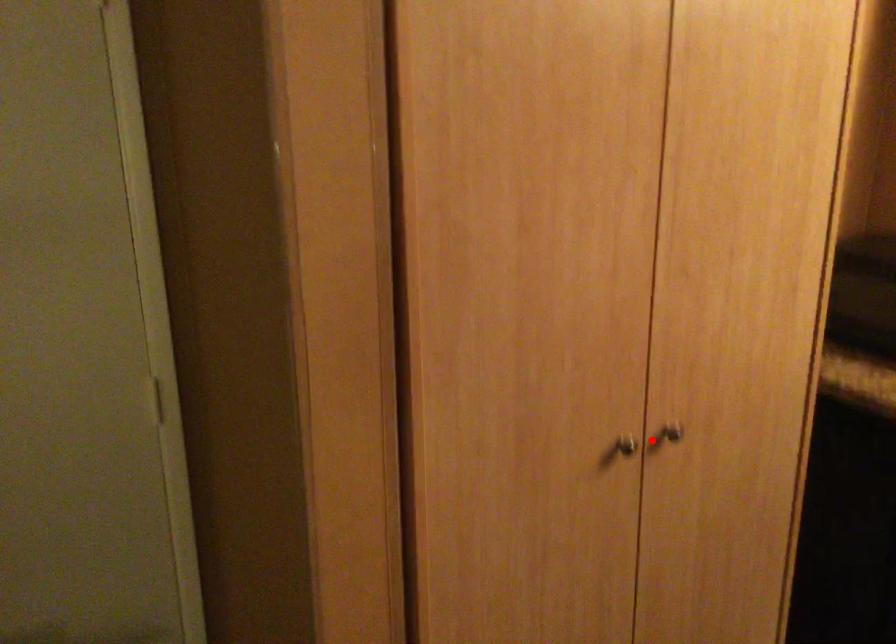
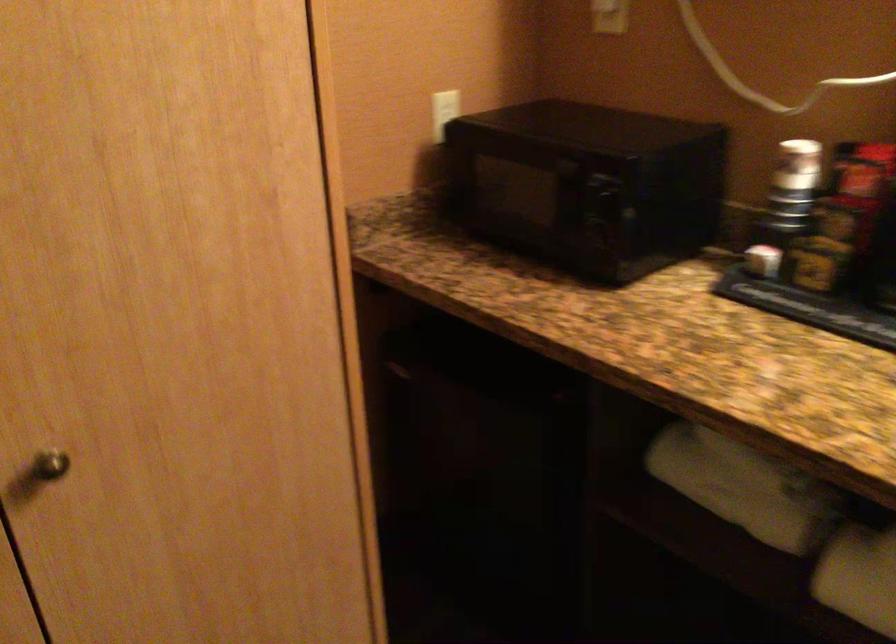
Find the pixel in the second image that matches the highlighted location in the first image.

(49, 465)